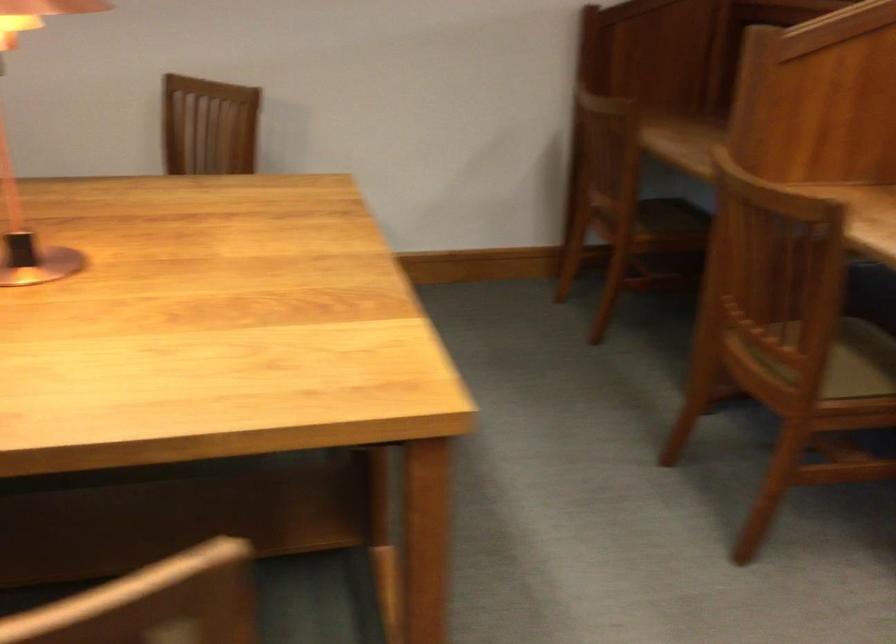
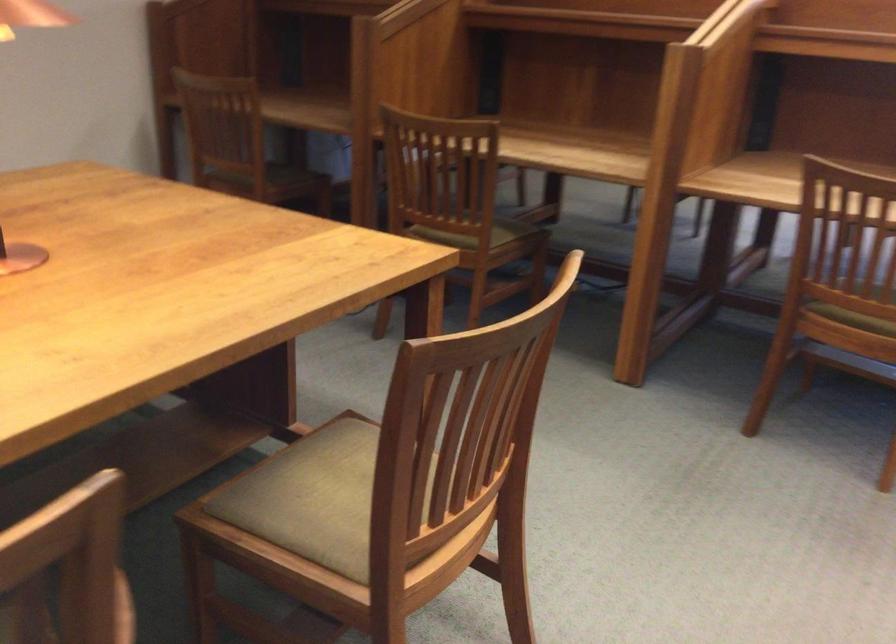
The point at (797,373) is marked in the first image. Where is the corresponding point in the second image?

(474, 234)